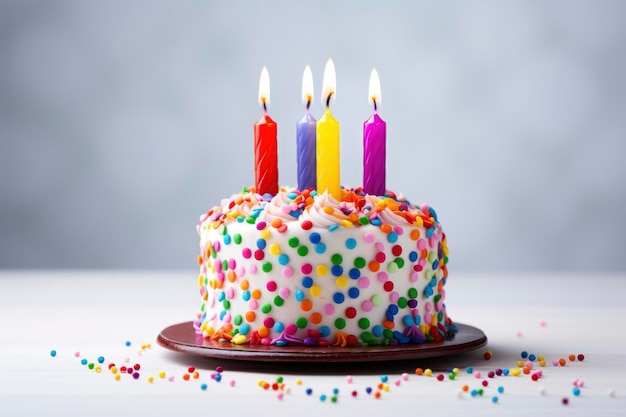
This screenshot has height=417, width=626. In order to click on birthday candles in this screenshot , I will do `click(264, 143)`, `click(304, 144)`, `click(330, 165)`, `click(376, 146)`.